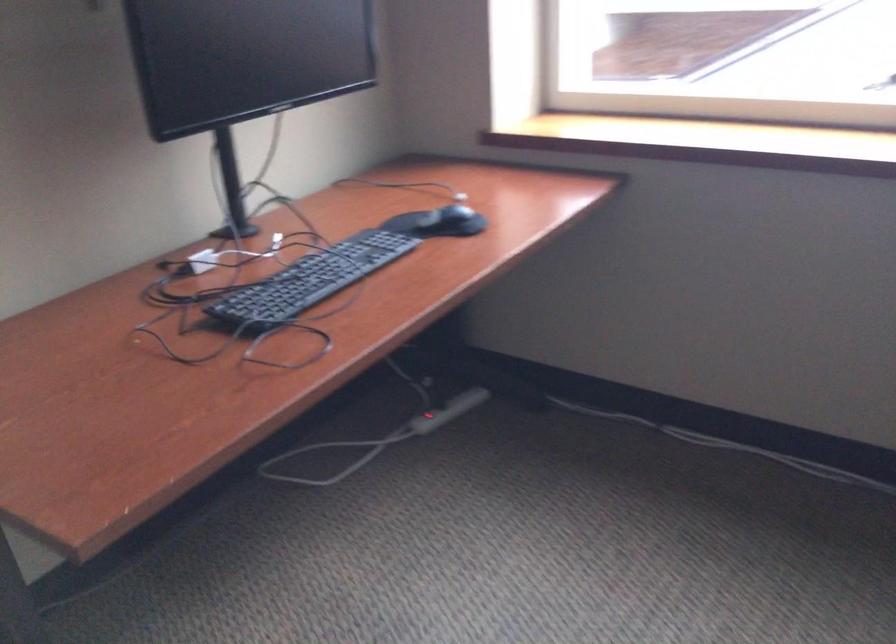
Image resolution: width=896 pixels, height=644 pixels. What are the coordinates of `power strip switch` in the screenshot? It's located at (428, 421).